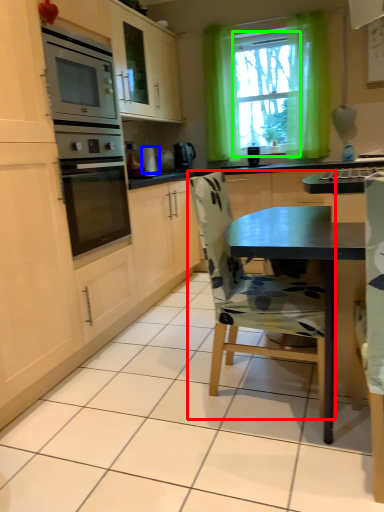
Question: Considering the real-world distances, which object is closest to chair (highlighted by a red box)? appliance (highlighted by a blue box) or window screen (highlighted by a green box).

Choices:
 (A) appliance
 (B) window screen

Answer: (A)